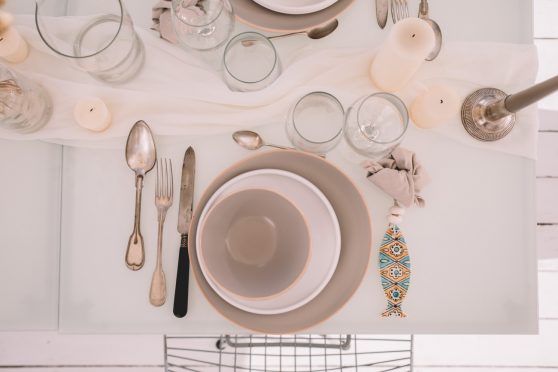
Where is `silverware`? silverware is located at coordinates (139, 188), (156, 206), (184, 212), (243, 142), (307, 33), (382, 13), (398, 9), (422, 6).